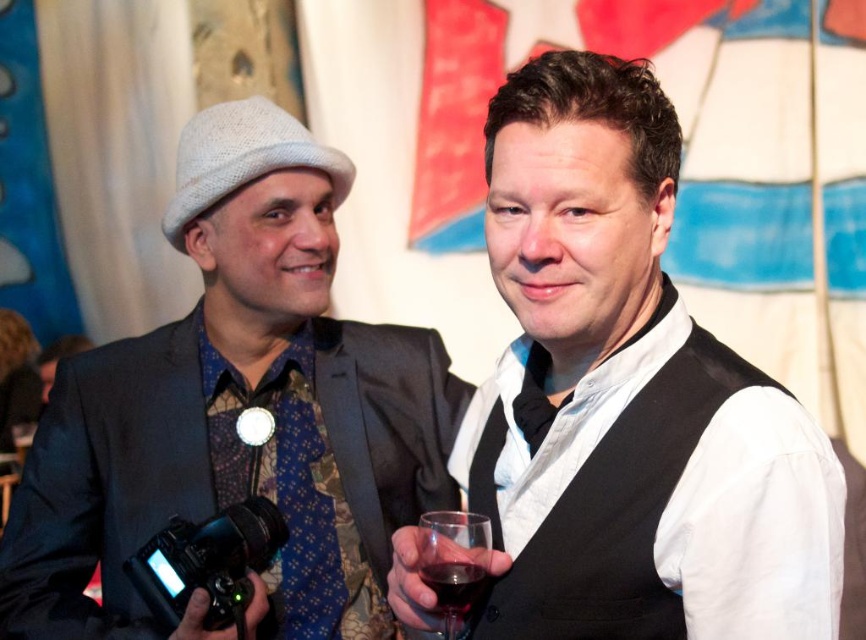
Question: Which point is farther from the camera taking this photo?

Choices:
 (A) (380, 440)
 (B) (466, 572)
 (C) (543, 388)
 (D) (470, 593)

Answer: (A)

Question: Can you confirm if white satin vest at center is smaller than black plastic video camera at lower left?

Choices:
 (A) yes
 (B) no

Answer: (B)

Question: Is black satin vest at right positioned in front of ruby glass at center?

Choices:
 (A) no
 (B) yes

Answer: (B)

Question: Is matte black suit at left closer to the viewer compared to black satin vest at right?

Choices:
 (A) yes
 (B) no

Answer: (B)

Question: Which point is closer to the camera taking this photo?

Choices:
 (A) (457, 604)
 (B) (527, 349)
 (C) (395, 568)
 (D) (292, 241)

Answer: (A)

Question: Which point is farther from the camera taking this photo?

Choices:
 (A) (474, 579)
 (B) (215, 541)
 (C) (541, 628)

Answer: (B)